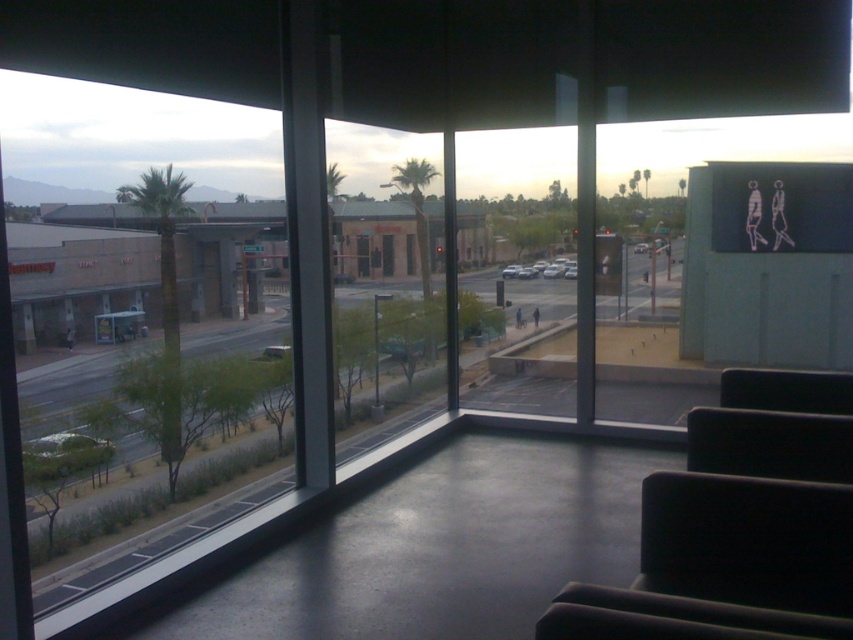
Consider the image. Which is more to the right, transparent glass window at left or black fabric armchair at lower right?

Positioned to the right is black fabric armchair at lower right.

Is transparent glass window at left positioned in front of black fabric armchair at lower right?

No, transparent glass window at left is further to the viewer.

Who is more distant from viewer, (1, 163) or (821, 444)?

Point (1, 163)

Find the location of a particular element. transparent glass window at left is located at coordinates (138, 317).